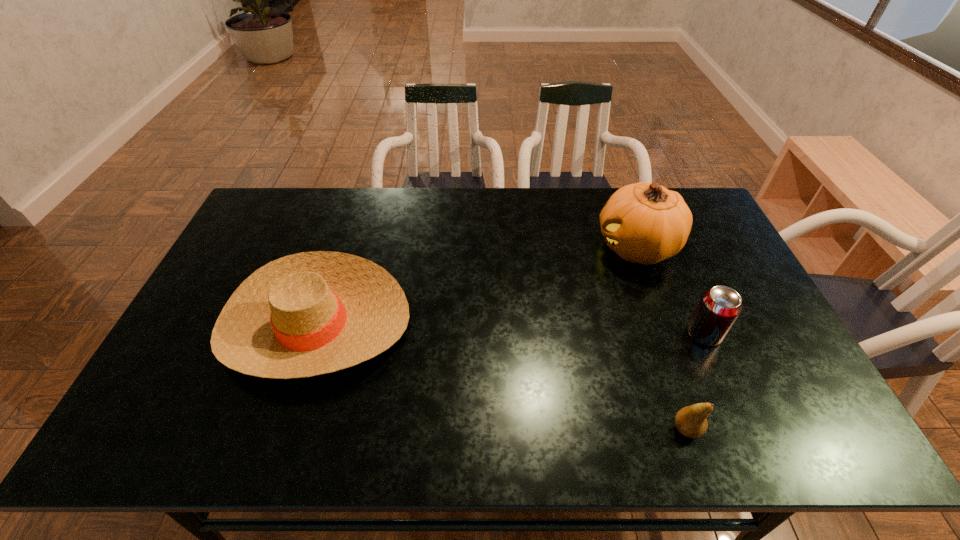
Identify the location of object present at the far edge. (646, 223).

The image size is (960, 540). In order to click on object present at the near edge in this screenshot , I will do `click(690, 421)`.

Locate an element on the screen. The height and width of the screenshot is (540, 960). object located in the left edge section of the desktop is located at coordinates (311, 313).

Locate an element on the screen. This screenshot has height=540, width=960. pumpkin situated at the right edge is located at coordinates (646, 223).

This screenshot has height=540, width=960. Find the location of `soda can located in the right edge section of the desktop`. soda can located in the right edge section of the desktop is located at coordinates (719, 307).

Where is `object that is at the far right corner`? object that is at the far right corner is located at coordinates (646, 223).

You are a GUI agent. You are given a task and a screenshot of the screen. Output one action in this format:
    pyautogui.click(x=<x>, y=<y>)
    Task: Click on the vacant space at the far edge of the desktop
    
    Given the screenshot: What is the action you would take?
    pyautogui.click(x=583, y=206)

At what (x,y) coordinates should I click in order to perform the action: click on free location at the near edge of the desktop. Please return your answer as a coordinate pair (x, y). This screenshot has height=540, width=960. Looking at the image, I should click on (332, 432).

In the image, there is a desktop. Identify the location of vacant region at the left edge. This screenshot has height=540, width=960. (186, 348).

Where is `vacant position at the right edge of the desktop`? This screenshot has height=540, width=960. vacant position at the right edge of the desktop is located at coordinates (729, 336).